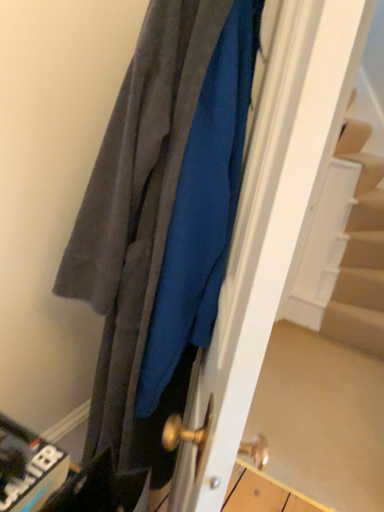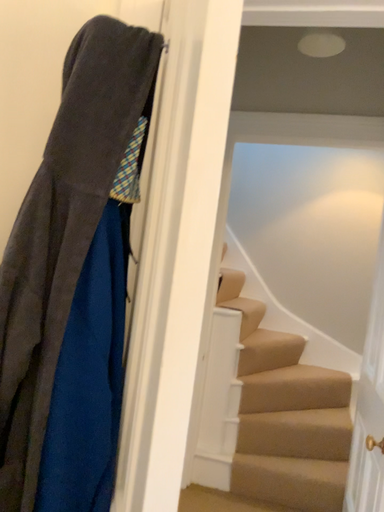
Question: Which way did the camera rotate in the video?

Choices:
 (A) rotated downward
 (B) rotated upward

Answer: (B)